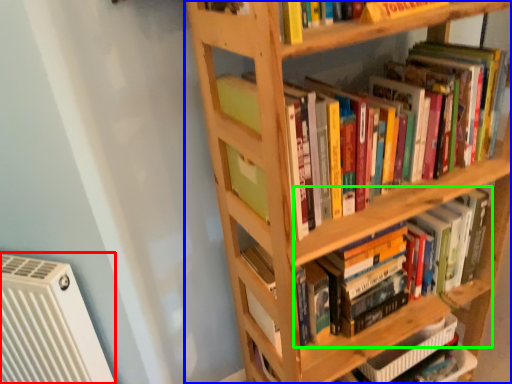
Question: Which object is positioned closest to air conditioning (highlighted by a red box)? Select from shelf (highlighted by a blue box) and book (highlighted by a green box).

Choices:
 (A) shelf
 (B) book

Answer: (A)